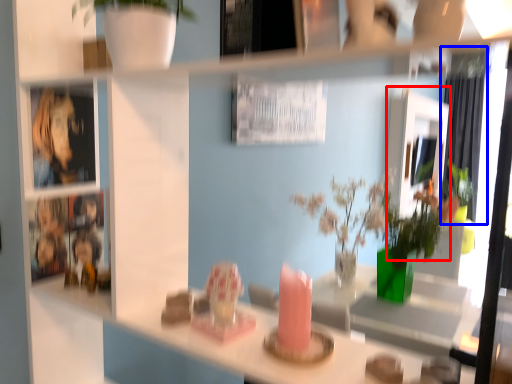
Question: Which of the following is the closest to the observer, mirror (highlighted by a red box) or curtain (highlighted by a blue box)?

Choices:
 (A) mirror
 (B) curtain

Answer: (A)